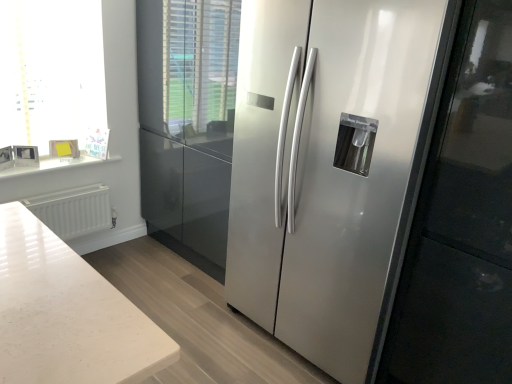
Question: From the image's perspective, is satin silver refrigerator at center on top of white matte radiator at lower left?

Choices:
 (A) no
 (B) yes

Answer: (B)

Question: Considering the relative sizes of satin silver refrigerator at center and white matte radiator at lower left in the image provided, is satin silver refrigerator at center shorter than white matte radiator at lower left?

Choices:
 (A) no
 (B) yes

Answer: (A)

Question: Does satin silver refrigerator at center have a greater width compared to white matte radiator at lower left?

Choices:
 (A) yes
 (B) no

Answer: (A)

Question: Does satin silver refrigerator at center touch white matte radiator at lower left?

Choices:
 (A) yes
 (B) no

Answer: (B)

Question: Is satin silver refrigerator at center positioned beyond the bounds of white matte radiator at lower left?

Choices:
 (A) yes
 (B) no

Answer: (A)

Question: Is satin silver refrigerator at center wider or thinner than white matte radiator at lower left?

Choices:
 (A) wide
 (B) thin

Answer: (A)

Question: Considering their positions, is satin silver refrigerator at center located in front of or behind white matte radiator at lower left?

Choices:
 (A) behind
 (B) front

Answer: (B)

Question: Considering the positions of satin silver refrigerator at center and white matte radiator at lower left in the image, is satin silver refrigerator at center bigger or smaller than white matte radiator at lower left?

Choices:
 (A) big
 (B) small

Answer: (A)

Question: Does point (316, 135) appear closer or farther from the camera than point (92, 226)?

Choices:
 (A) closer
 (B) farther

Answer: (A)

Question: In terms of width, does white glossy frame at upper left look wider or thinner when compared to white marble counter top at upper left?

Choices:
 (A) wide
 (B) thin

Answer: (A)

Question: Is white glossy frame at upper left inside or outside of white marble counter top at upper left?

Choices:
 (A) inside
 (B) outside

Answer: (B)

Question: From the image's perspective, is white glossy frame at upper left positioned above or below white marble counter top at upper left?

Choices:
 (A) above
 (B) below

Answer: (A)

Question: Considering the positions of white glossy frame at upper left and white marble counter top at upper left in the image, is white glossy frame at upper left bigger or smaller than white marble counter top at upper left?

Choices:
 (A) big
 (B) small

Answer: (A)

Question: Considering the positions of point (15, 127) and point (412, 94), is point (15, 127) closer or farther from the camera than point (412, 94)?

Choices:
 (A) farther
 (B) closer

Answer: (A)

Question: Is white glossy frame at upper left in front of or behind satin silver refrigerator at center in the image?

Choices:
 (A) behind
 (B) front

Answer: (A)